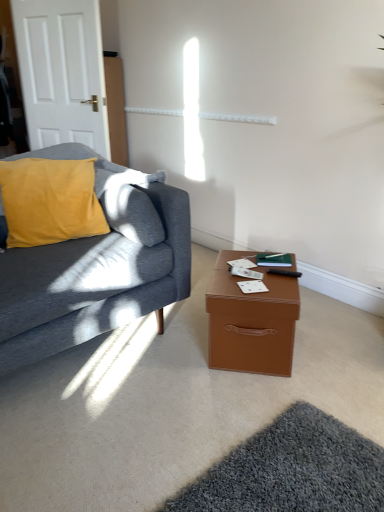
Question: In terms of width, does velvet mustard pillow at left look wider or thinner when compared to black plastic remote control at lower right?

Choices:
 (A) thin
 (B) wide

Answer: (B)

Question: Would you say velvet mustard pillow at left is to the left or to the right of black plastic remote control at lower right in the picture?

Choices:
 (A) left
 (B) right

Answer: (A)

Question: Based on their relative distances, which object is nearer to the velvet yellow pillow at left?

Choices:
 (A) white matte door at upper left
 (B) black plastic remote control at lower right
 (C) velvet mustard pillow at left
 (D) brown leather-like box at lower right

Answer: (C)

Question: Estimate the real-world distances between objects in this image. Which object is farther from the velvet yellow pillow at left?

Choices:
 (A) white matte door at upper left
 (B) velvet mustard pillow at left
 (C) black plastic remote control at lower right
 (D) brown leather-like box at lower right

Answer: (A)